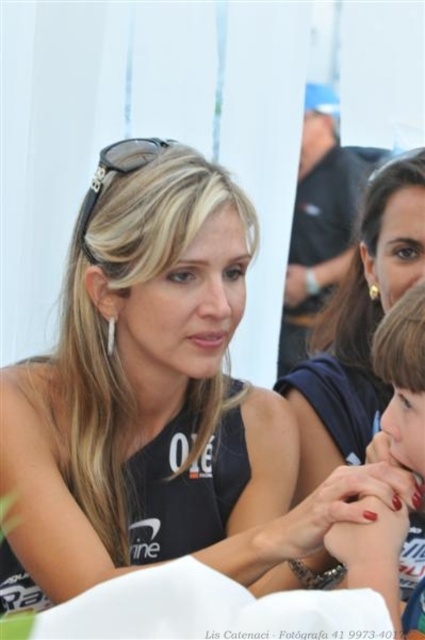
Question: Which point appears closest to the camera in this image?

Choices:
 (A) (36, 412)
 (B) (419, 284)

Answer: (B)

Question: Among these points, which one is nearest to the camera?

Choices:
 (A) (376, 356)
 (B) (192, 518)

Answer: (A)

Question: Can you confirm if matte black tank top at center is wider than blonde hair at center?

Choices:
 (A) yes
 (B) no

Answer: (A)

Question: Can you confirm if matte black tank top at center is positioned to the left of blonde hair at center?

Choices:
 (A) yes
 (B) no

Answer: (A)

Question: Is matte black tank top at center above blonde hair at center?

Choices:
 (A) no
 (B) yes

Answer: (B)